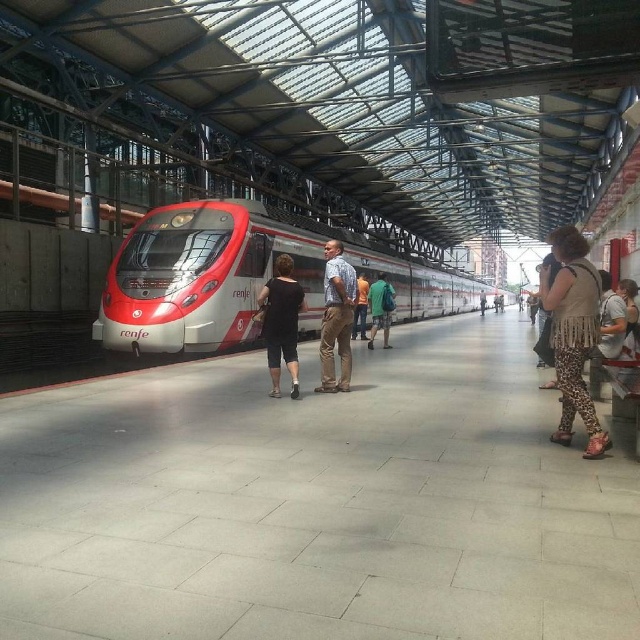
You are a passenger standing on the platform and want to board the silver metallic train at center. There is a person wearing light brown cotton pants at center blocking your path. Can you walk around them to reach the train?

The silver metallic train at center is further to the viewer than light brown cotton pants at center, meaning the train is closer to you. Since the train is closer, you can simply step around the person wearing light brown cotton pants at center towards the train without needing to go around them, as the train is already in front of the person.